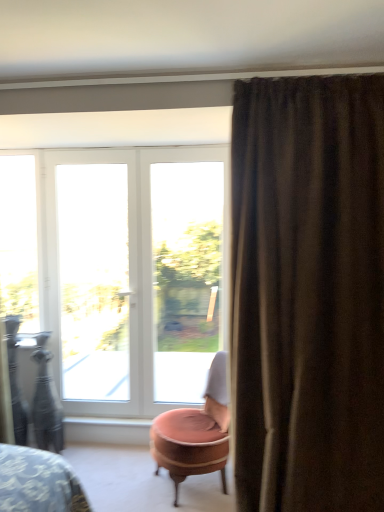
Question: Is white glossy window sill at lower center shorter than white glass door at center?

Choices:
 (A) no
 (B) yes

Answer: (B)

Question: Is white glossy window sill at lower center further to camera compared to white glass door at center?

Choices:
 (A) no
 (B) yes

Answer: (B)

Question: Is white glossy window sill at lower center oriented towards white glass door at center?

Choices:
 (A) no
 (B) yes

Answer: (A)

Question: Does white glossy window sill at lower center have a greater width compared to white glass door at center?

Choices:
 (A) yes
 (B) no

Answer: (A)

Question: Is white glossy window sill at lower center closer to the viewer compared to white glass door at center?

Choices:
 (A) no
 (B) yes

Answer: (A)

Question: Can you confirm if white glossy window sill at lower center is thinner than white glass door at center?

Choices:
 (A) yes
 (B) no

Answer: (B)

Question: Is the position of white glass door at left, placed as the 2th window when sorted from right to left, more distant than that of pink velvet ottoman at center?

Choices:
 (A) yes
 (B) no

Answer: (A)

Question: Is white glass door at left, placed as the 2th window when sorted from right to left, to the left of pink velvet ottoman at center from the viewer's perspective?

Choices:
 (A) yes
 (B) no

Answer: (A)

Question: Does white glass door at left, placed as the 2th window when sorted from right to left, have a greater height compared to pink velvet ottoman at center?

Choices:
 (A) yes
 (B) no

Answer: (A)

Question: Does white glass door at left, which appears as the 2th window when viewed from the left, have a larger size compared to pink velvet ottoman at center?

Choices:
 (A) no
 (B) yes

Answer: (A)

Question: From a real-world perspective, is white glass door at left, placed as the 2th window when sorted from right to left, over pink velvet ottoman at center?

Choices:
 (A) yes
 (B) no

Answer: (A)

Question: Is white glass door at left, which appears as the 2th window when viewed from the left, positioned with its back to pink velvet ottoman at center?

Choices:
 (A) no
 (B) yes

Answer: (A)

Question: Is brown textured curtain at right far away from white plastic window at center, which is the first window from right to left?

Choices:
 (A) yes
 (B) no

Answer: (A)